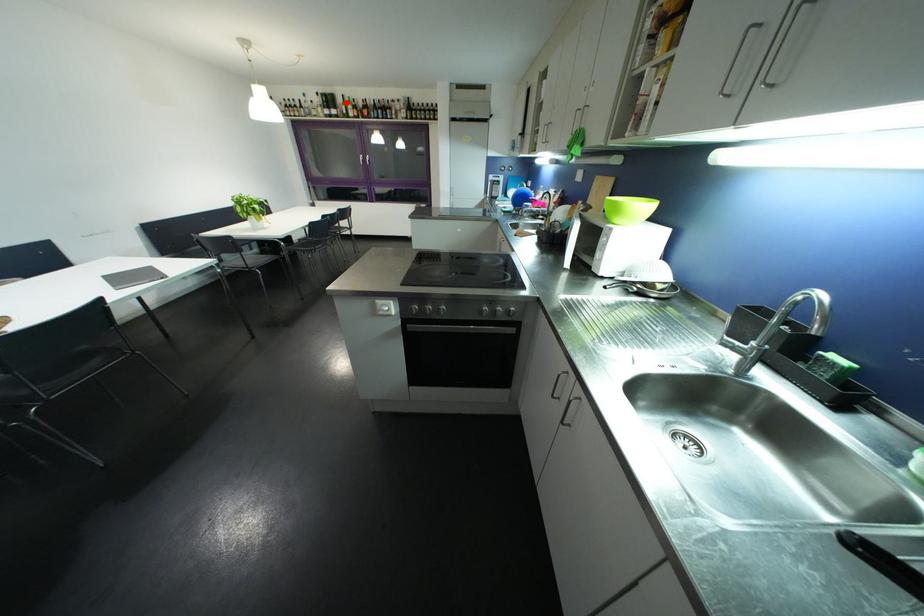
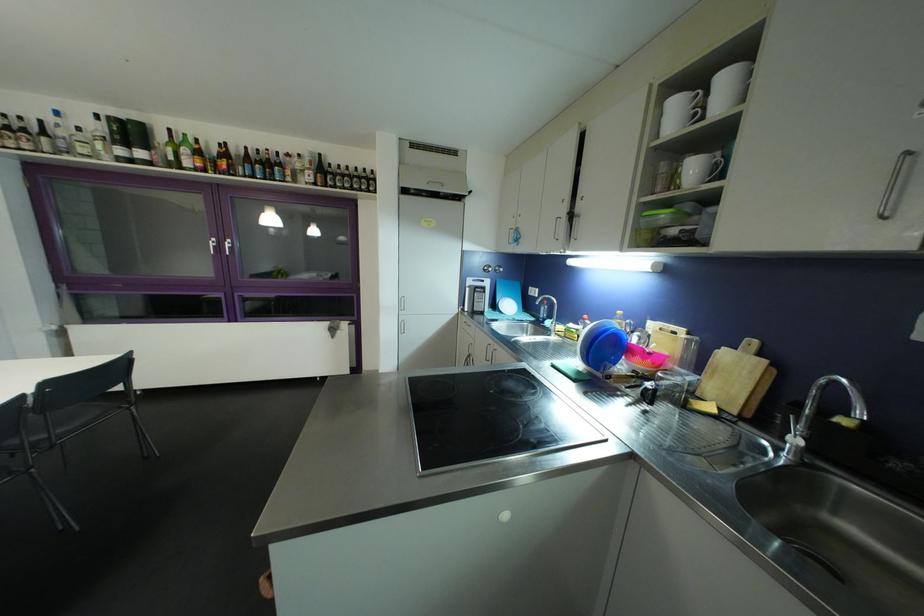
Locate, in the second image, the point that corresponds to the highlighted location in the first image.

(167, 140)